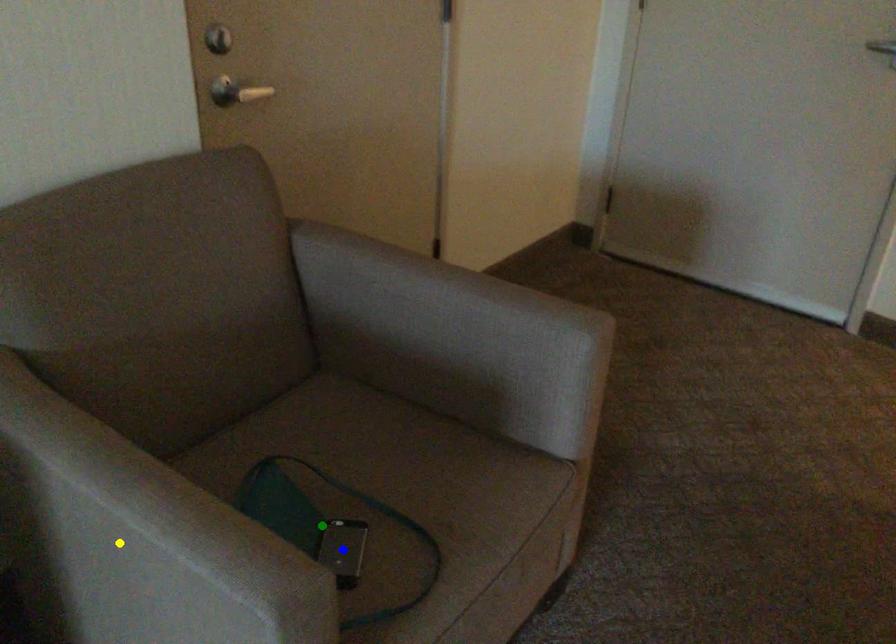
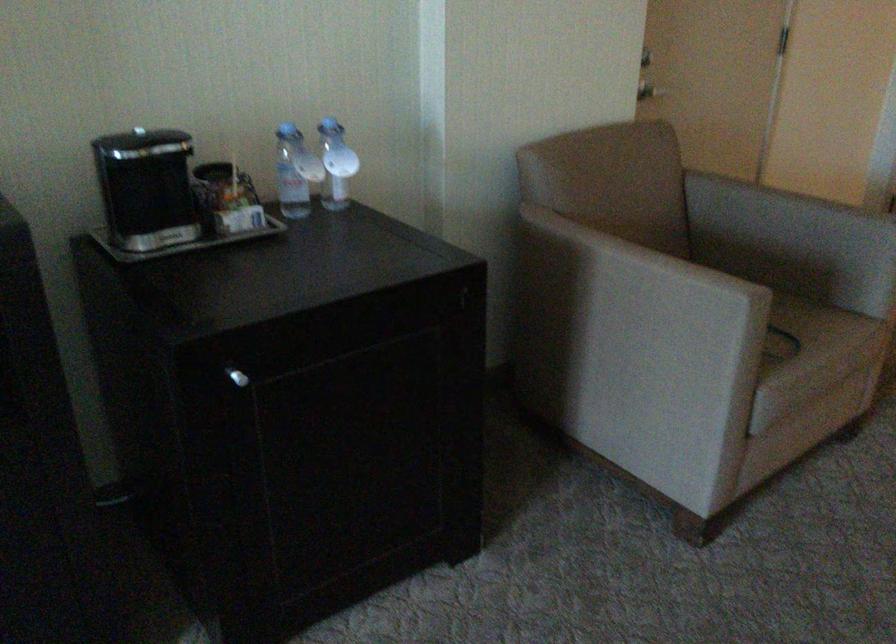
I am providing you with two images of the same scene from different viewpoints. Three points are marked in image1. Which point corresponds to a part or object that is occluded in image2?In image1, three points are marked. Which of them correspond to a part or object that is occluded in image2?Among the three points shown in image1, which one corresponds to a part or object that is no longer visible due to occlusion in image2?

blue point, green point